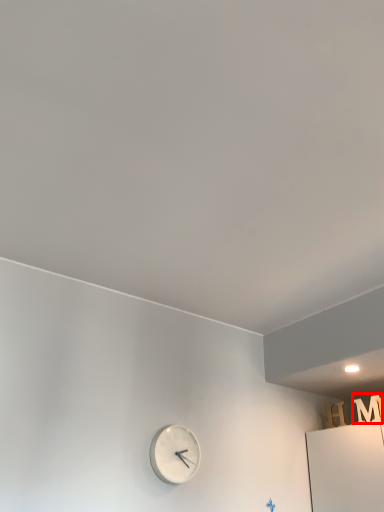
Question: In this image, where is letter (annotated by the red box) located relative to wall clock?

Choices:
 (A) right
 (B) left

Answer: (A)